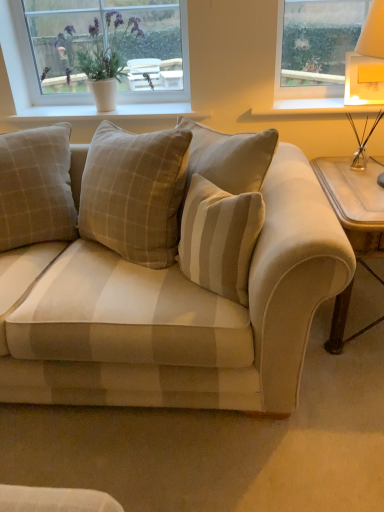
Question: Considering the relative positions of white painted wood at upper right and beige plaid pillow at center in the image provided, is white painted wood at upper right to the left or to the right of beige plaid pillow at center?

Choices:
 (A) right
 (B) left

Answer: (A)

Question: Is white painted wood at upper right spatially inside beige plaid pillow at center, or outside of it?

Choices:
 (A) outside
 (B) inside

Answer: (A)

Question: Which is farther from the white textured window at upper left?

Choices:
 (A) white painted wood at upper right
 (B) beige plaid pillow at center
 (C) beige fabric couch at center
 (D) wooden side table at right

Answer: (D)

Question: Which object is positioned closest to the white textured window at upper left?

Choices:
 (A) beige plaid pillow at center
 (B) white painted wood at upper right
 (C) wooden side table at right
 (D) beige fabric couch at center

Answer: (A)